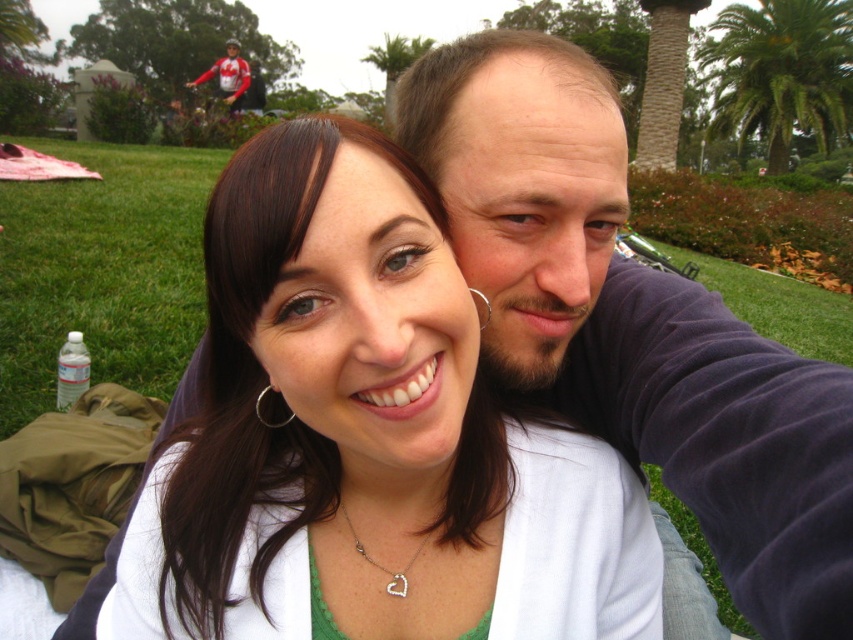
You are taking a photo of two friends in a park. The matte white shirt at center is below the green leafy palm tree at upper right. Which object is positioned higher in the image?

The green leafy palm tree at upper right is positioned higher in the image than the matte white shirt at center.

You are trying to decide which clothing item to wear for a casual day out. You have a matte white shirt at center and a dark purple sweater at center. Based on the image, which one is more to the left?

The matte white shirt at center is more to the left than the dark purple sweater at center.